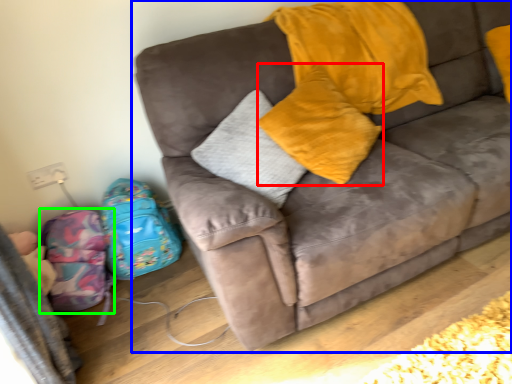
Question: Estimate the real-world distances between objects in this image. Which object is closer to pillow (highlighted by a red box), studio couch (highlighted by a blue box) or luggage (highlighted by a green box)?

Choices:
 (A) studio couch
 (B) luggage

Answer: (A)